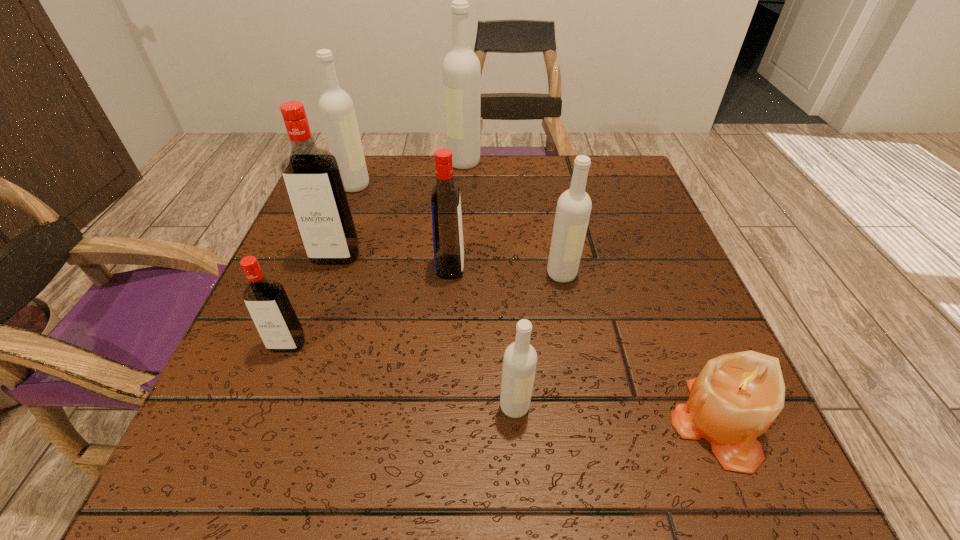
I want to click on free space located 0.060m on the front of the nearest white vodka, so click(x=518, y=463).

Where is `vacant space located on the left of the rightmost object`? vacant space located on the left of the rightmost object is located at coordinates (569, 422).

Where is `object that is at the near edge`? The width and height of the screenshot is (960, 540). object that is at the near edge is located at coordinates (736, 397).

You are a GUI agent. You are given a task and a screenshot of the screen. Output one action in this format:
    pyautogui.click(x=<x>, y=<y>)
    Task: Click on the object located at the right edge
    This screenshot has height=540, width=960.
    Given the screenshot: What is the action you would take?
    pyautogui.click(x=736, y=397)

Locate an element on the screen. The height and width of the screenshot is (540, 960). object present at the far left corner is located at coordinates (336, 107).

The image size is (960, 540). I want to click on object that is at the near right corner, so click(x=736, y=397).

Locate an element on the screen. This screenshot has height=540, width=960. vacant area at the far edge of the desktop is located at coordinates (391, 180).

You are a GUI agent. You are given a task and a screenshot of the screen. Output one action in this format:
    pyautogui.click(x=<x>, y=<y>)
    Task: Click on the free space at the near edge of the desktop
    
    Given the screenshot: What is the action you would take?
    pyautogui.click(x=451, y=451)

This screenshot has width=960, height=540. Find the location of `vacant area at the left edge of the desktop`. vacant area at the left edge of the desktop is located at coordinates (293, 379).

Identify the location of free location at the right edge. Image resolution: width=960 pixels, height=540 pixels. pyautogui.click(x=605, y=233).